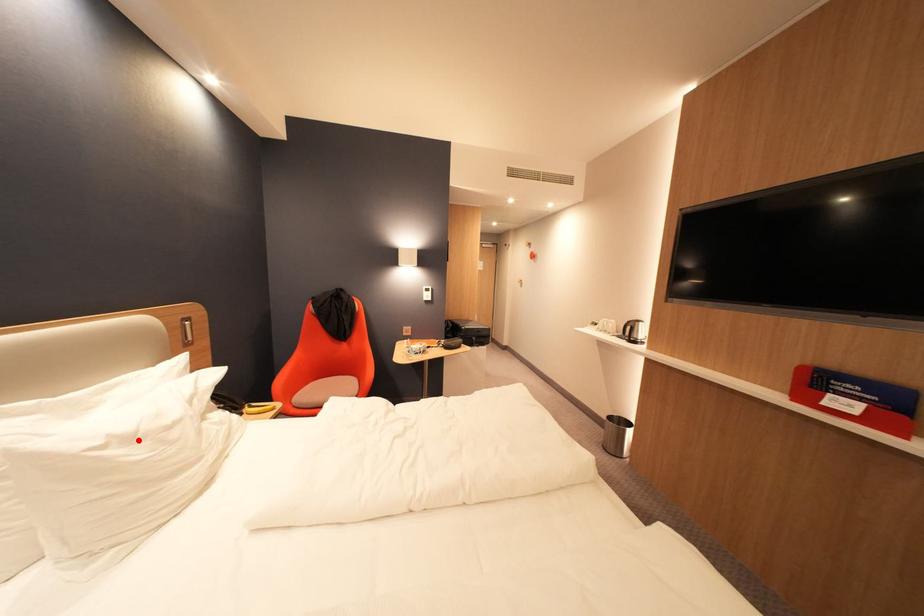
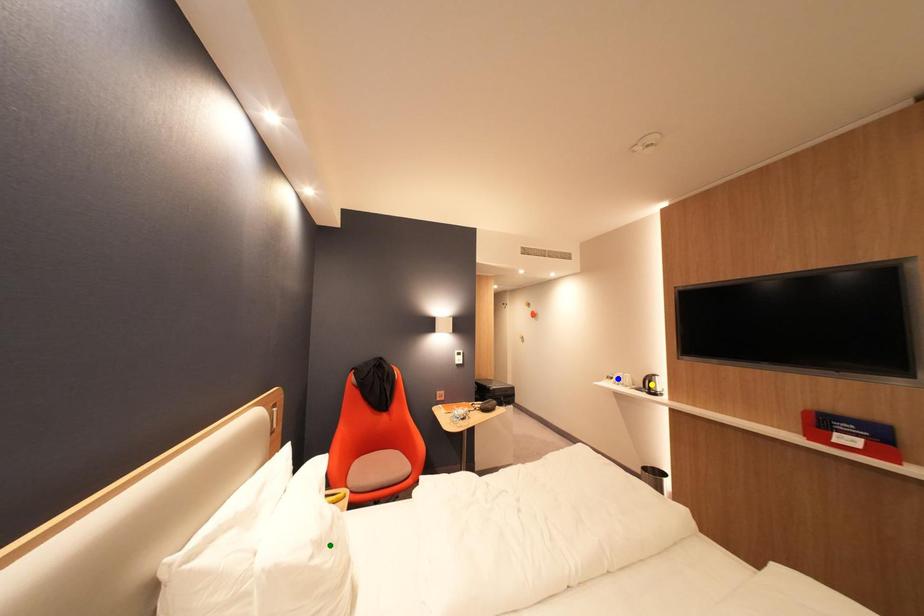
Question: I am providing you with two images of the same scene from different viewpoints. A red point is marked on the first image. You are given multiple points on the second image. Which mark in image 2 goes with the point in image 1?

Choices:
 (A) blue point
 (B) green point
 (C) yellow point

Answer: (B)